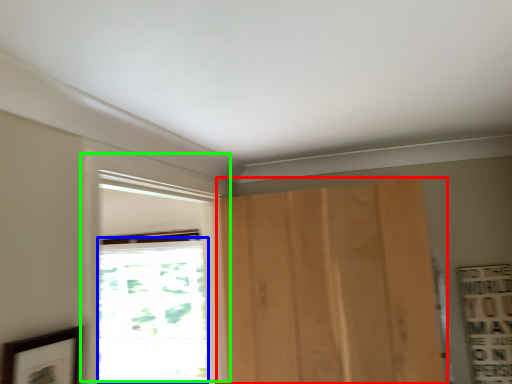
Question: Which is nearer to the door (highlighted by a red box)? window (highlighted by a blue box) or window (highlighted by a green box).

Choices:
 (A) window
 (B) window

Answer: (B)